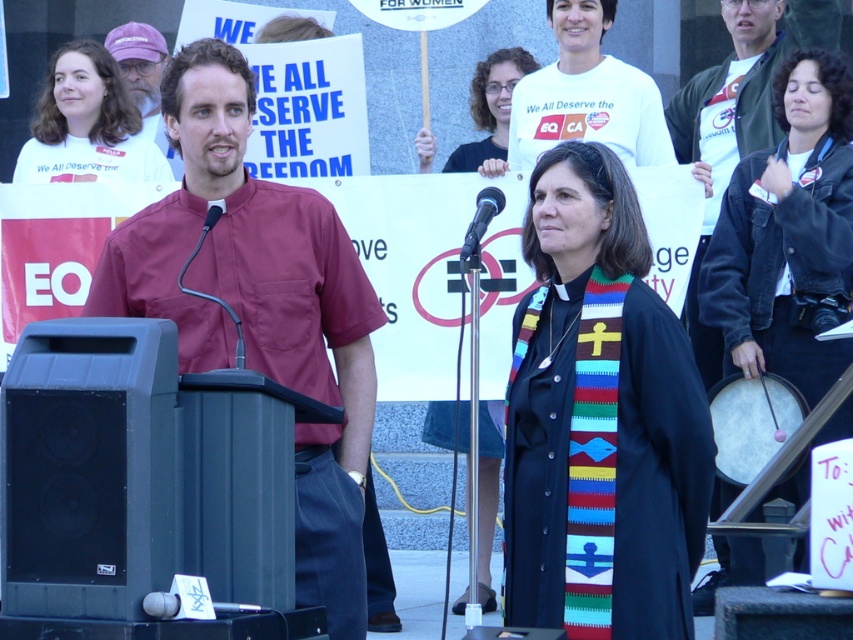
This screenshot has width=853, height=640. What do you see at coordinates (86, 124) in the screenshot?
I see `matte white t-shirt at upper left` at bounding box center [86, 124].

Is matte white t-shirt at upper left wider than black metallic microphone at center?

No, matte white t-shirt at upper left is not wider than black metallic microphone at center.

What do you see at coordinates (86, 124) in the screenshot? I see `matte white t-shirt at upper left` at bounding box center [86, 124].

Locate an element on the screen. The height and width of the screenshot is (640, 853). matte white t-shirt at upper left is located at coordinates (86, 124).

Can you confirm if black woolen robe at center is positioned below black plastic microphone at center?

No, black woolen robe at center is not below black plastic microphone at center.

Does black woolen robe at center appear over black plastic microphone at center?

Yes.

Is point (689, 346) closer to viewer compared to point (212, 221)?

Yes, it is.

Where is `black woolen robe at center`? This screenshot has height=640, width=853. black woolen robe at center is located at coordinates (599, 419).

Is black leather jacket at lower right wider than black plastic microphone at center?

Yes, black leather jacket at lower right is wider than black plastic microphone at center.

Between black leather jacket at lower right and black plastic microphone at center, which one has less height?

black plastic microphone at center

I want to click on black leather jacket at lower right, so click(788, 234).